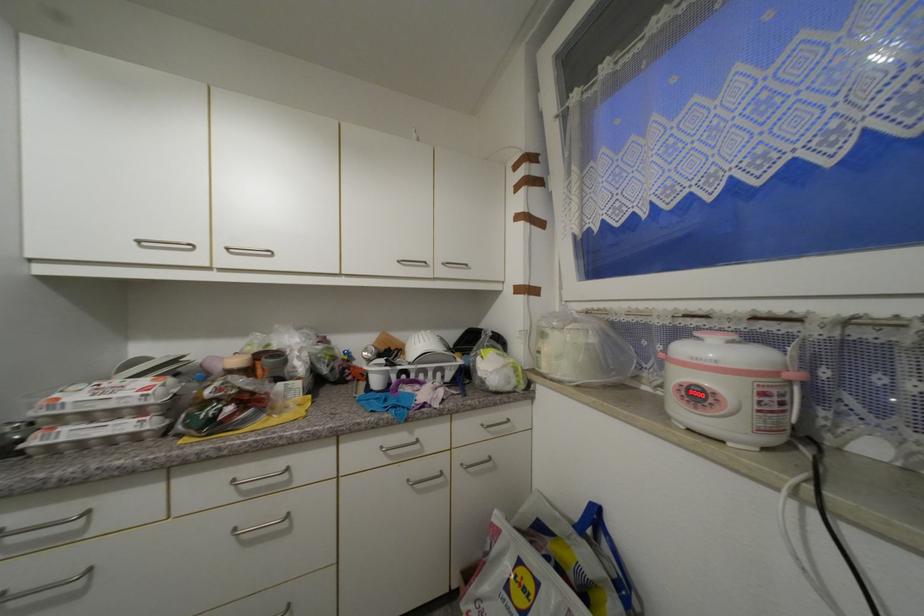
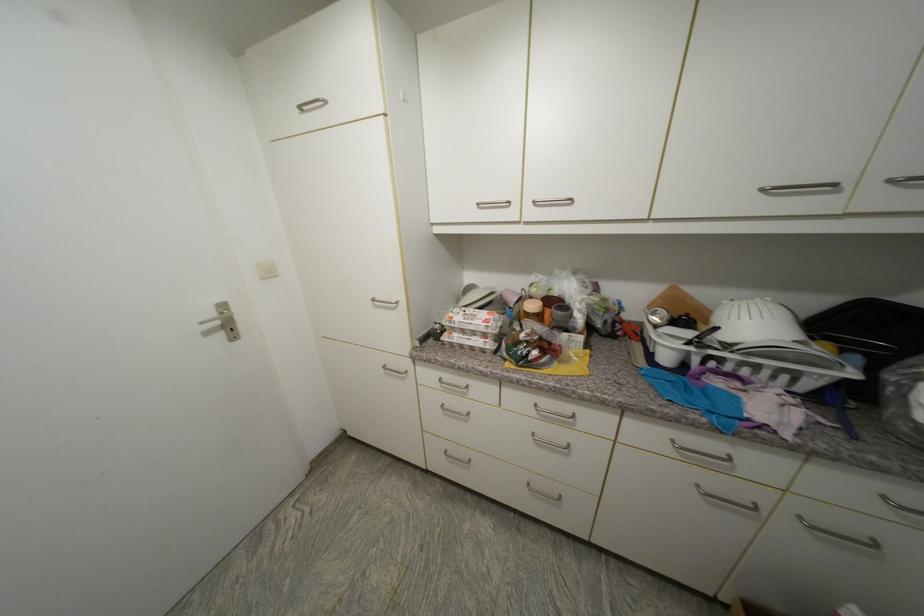
Where in the second image is the point corresponding to point (64, 400) from the first image?

(457, 318)